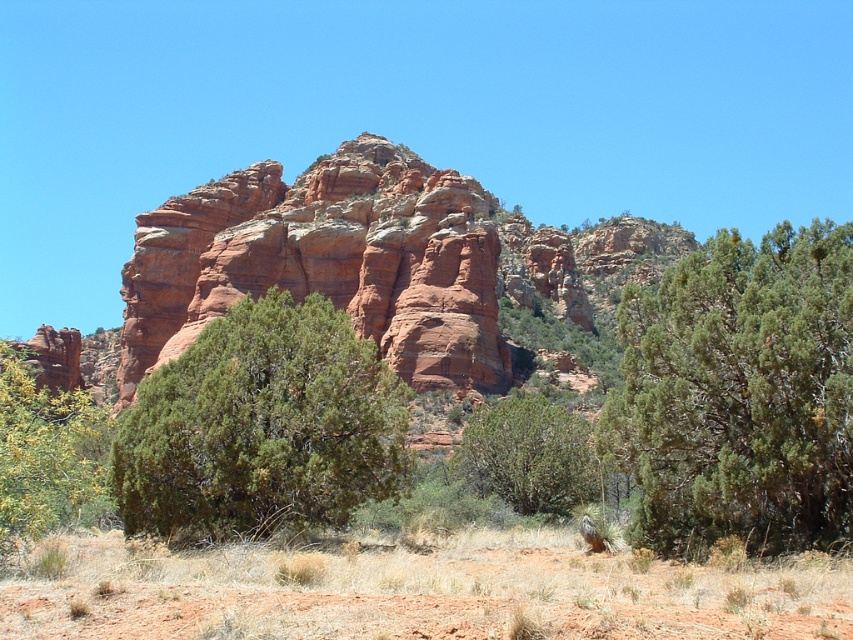
Question: Is dry grass at lower center positioned behind green textured bush at center?

Choices:
 (A) no
 (B) yes

Answer: (A)

Question: Based on their relative distances, which object is nearer to the green leafy bush at center?

Choices:
 (A) green textured bush at center
 (B) green textured bush at right
 (C) dry grass at lower center
 (D) green leafy bush at lower left

Answer: (B)

Question: Can you confirm if dry grass at lower center is positioned below green leafy bush at center?

Choices:
 (A) no
 (B) yes

Answer: (B)

Question: Among these objects, which one is nearest to the camera?

Choices:
 (A) dry grass at lower center
 (B) green leafy bush at lower left

Answer: (A)

Question: Which point is closer to the camera?

Choices:
 (A) green leafy bush at lower left
 (B) dry grass at lower center
 (C) green leafy bush at center

Answer: (B)

Question: Is green textured bush at right positioned before green leafy bush at lower left?

Choices:
 (A) no
 (B) yes

Answer: (A)